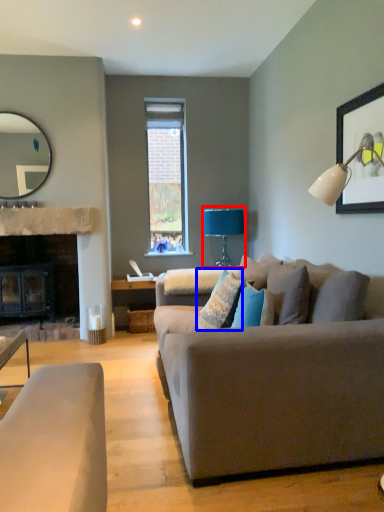
Question: Among these objects, which one is nearest to the camera, table lamp (highlighted by a red box) or pillow (highlighted by a blue box)?

Choices:
 (A) table lamp
 (B) pillow

Answer: (B)